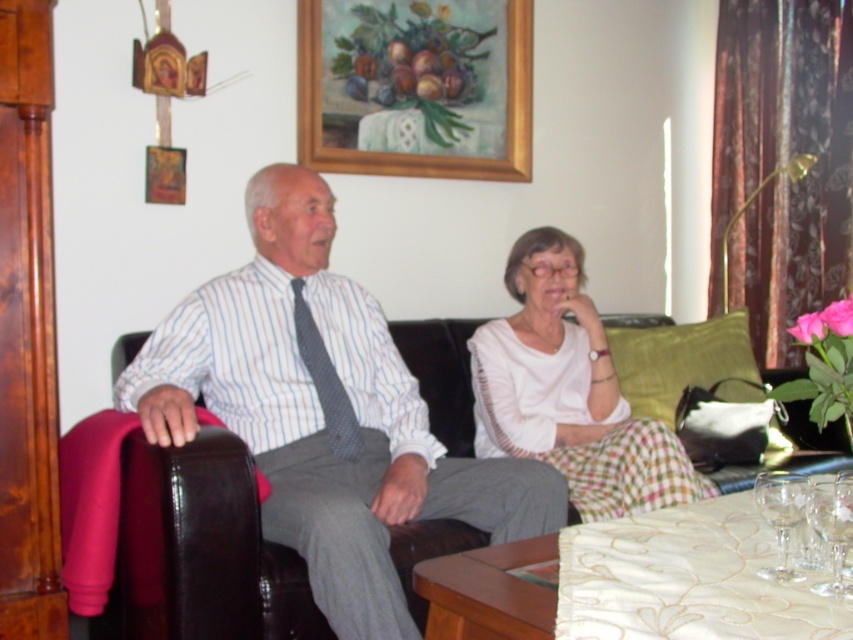
Is wooden frame at upper center thinner than white cotton blouse at center?

No, wooden frame at upper center is not thinner than white cotton blouse at center.

Is point (310, 116) farther from viewer compared to point (572, 364)?

That is True.

At what (x,y) coordinates should I click in order to perform the action: click on wooden frame at upper center. Please return your answer as a coordinate pair (x, y). Looking at the image, I should click on (415, 88).

Who is more distant from viewer, (462, 422) or (848, 513)?

The point (462, 422) is more distant.

Is point (201, 444) farther from viewer compared to point (834, 504)?

Yes.

The height and width of the screenshot is (640, 853). I want to click on black leather couch at center, so click(233, 556).

In the scene shown: Which is above, wooden frame at upper center or clear glass wine glass at lower right?

Positioned higher is wooden frame at upper center.

Based on the photo, who is more distant from viewer, (515, 109) or (831, 499)?

The point (515, 109) is more distant.

Is point (413, 1) farther from viewer compared to point (838, 570)?

That is True.

In order to click on wooden frame at upper center in this screenshot , I will do `click(415, 88)`.